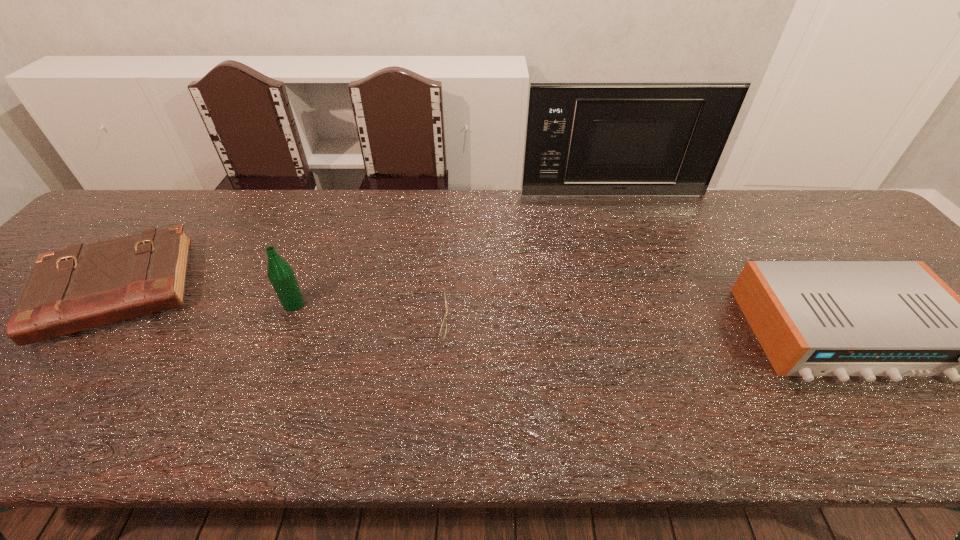
At what (x,y) coordinates should I click in order to perform the action: click on vacant region that satisfies the following two spatial constraints: 1. on the front panel of the farthest object; 2. on the front-facing side of the third object from left to right. Please return your answer as a coordinate pair (x, y). The width and height of the screenshot is (960, 540). Looking at the image, I should click on (658, 321).

Locate an element on the screen. free space in the image that satisfies the following two spatial constraints: 1. on the front panel of the tallest object; 2. on the front-facing side of the third object from left to right is located at coordinates (658, 321).

Locate an element on the screen. This screenshot has width=960, height=540. free spot that satisfies the following two spatial constraints: 1. on the front panel of the tallest object; 2. on the front-facing side of the third object from right to left is located at coordinates (658, 321).

You are a GUI agent. You are given a task and a screenshot of the screen. Output one action in this format:
    pyautogui.click(x=<x>, y=<y>)
    Task: Click on the free space that satisfies the following two spatial constraints: 1. on the front panel of the tallest object; 2. on the front-facing side of the shortest object
    This screenshot has height=540, width=960.
    Given the screenshot: What is the action you would take?
    pyautogui.click(x=658, y=321)